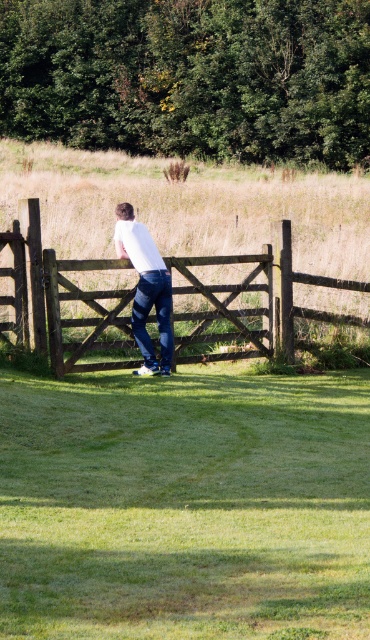
Question: Can you confirm if wooden gate at center is wider than white matte shirt at center?

Choices:
 (A) yes
 (B) no

Answer: (A)

Question: Does green grass at center appear on the left side of wooden gate at center?

Choices:
 (A) no
 (B) yes

Answer: (B)

Question: Which point is closer to the camera taking this photo?

Choices:
 (A) (169, 362)
 (B) (108, 259)
 (C) (126, 403)

Answer: (C)

Question: Which point is closer to the camera taking this photo?

Choices:
 (A) (338, 595)
 (B) (230, 308)
 (C) (163, 272)

Answer: (A)

Question: Is green grass at center thinner than white matte shirt at center?

Choices:
 (A) yes
 (B) no

Answer: (A)

Question: Estimate the real-world distances between objects in this image. Which object is closer to the wooden gate at center?

Choices:
 (A) white matte shirt at center
 (B) green grass at center

Answer: (A)